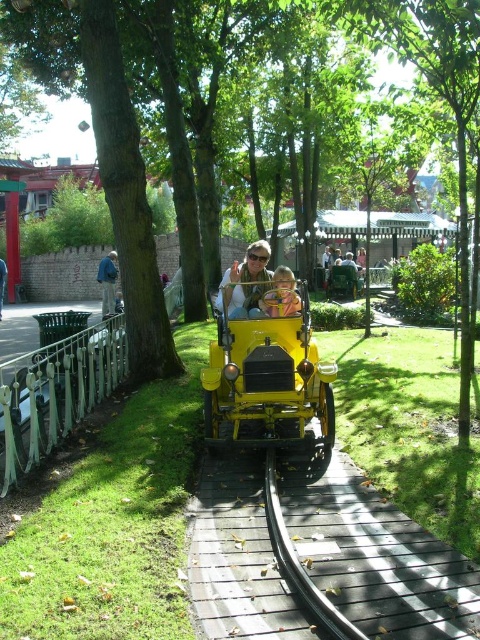
Between point (208, 396) and point (276, 296), which one is positioned in front?

Positioned in front is point (208, 396).

Who is shorter, shiny yellow toy car at center or matte yellow car at center?

Standing shorter between the two is matte yellow car at center.

Locate an element on the screen. The width and height of the screenshot is (480, 640). shiny yellow toy car at center is located at coordinates (267, 371).

Between point (333, 465) and point (112, 253), which one is positioned behind?

The point (112, 253) is more distant.

This screenshot has width=480, height=640. What do you see at coordinates (369, 561) in the screenshot? I see `wooden at center` at bounding box center [369, 561].

Image resolution: width=480 pixels, height=640 pixels. What do you see at coordinates (369, 561) in the screenshot?
I see `wooden at center` at bounding box center [369, 561].

Where is `wooden at center`? Image resolution: width=480 pixels, height=640 pixels. wooden at center is located at coordinates tap(369, 561).

Can you confirm if matte yellow car at center is smaller than denim jacket at left?

Indeed, matte yellow car at center has a smaller size compared to denim jacket at left.

Can you confirm if matte yellow car at center is taller than denim jacket at left?

In fact, matte yellow car at center may be shorter than denim jacket at left.

Which is in front, point (294, 289) or point (105, 310)?

Point (294, 289)

I want to click on matte yellow car at center, so click(280, 294).